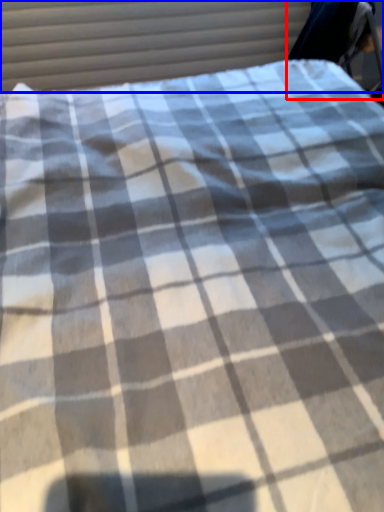
Question: Among these objects, which one is nearest to the camera, swivel chair (highlighted by a red box) or curtain (highlighted by a blue box)?

Choices:
 (A) swivel chair
 (B) curtain

Answer: (A)